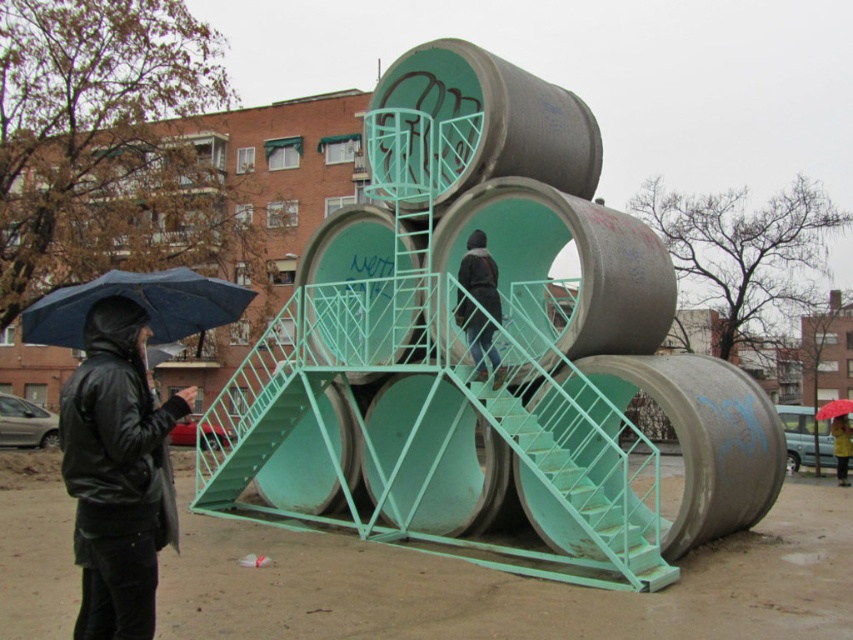
You are a photographer trying to capture the yellow matte jacket at upper center and the red matte umbrella at upper right in the same frame. Based on their sizes, which object should you focus on first to ensure both fit in the frame?

The yellow matte jacket at upper center is thinner than the red matte umbrella at upper right, so you should focus on the wider red matte umbrella at upper right first to ensure both fit in the frame.

You are a maintenance worker needing to reach the top of the green painted metal stairs at center to inspect its structure. Considering the height of the stairs and the dark gray hoodie at center, can you safely climb the stairs without needing a ladder?

The green painted metal stairs at center has a lesser height compared to dark gray hoodie at center, which implies the stairs are shorter than the hoodie wearer. Since the stairs are shorter than the person, you can safely climb them without needing a ladder.